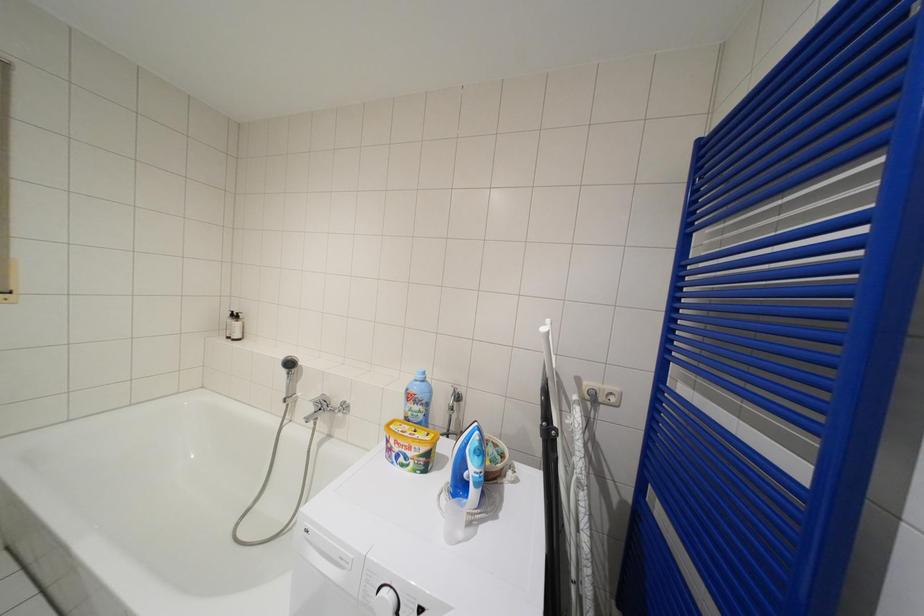
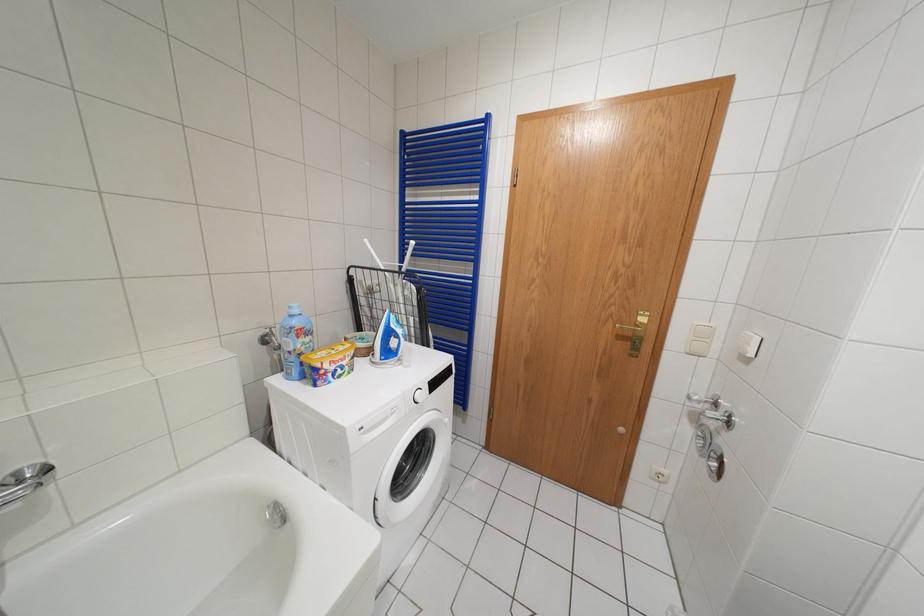
How did the camera likely rotate?

The camera rotated toward right-down.